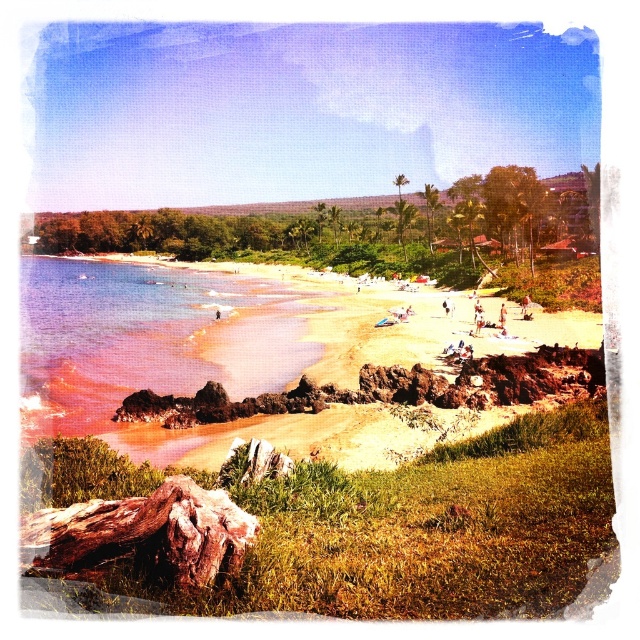
Question: Which point appears closest to the camera in this image?

Choices:
 (A) click(x=339, y=403)
 (B) click(x=77, y=340)

Answer: (A)

Question: Can you confirm if smooth sand beach at center is positioned to the right of pink sand at beach left?

Choices:
 (A) yes
 (B) no

Answer: (A)

Question: Which object appears closest to the camera in this image?

Choices:
 (A) smooth sand beach at center
 (B) pink sand at beach left

Answer: (A)

Question: Among these points, which one is farthest from the camera?

Choices:
 (A) (109, 349)
 (B) (33, 392)

Answer: (A)

Question: Is smooth sand beach at center bigger than pink sand at beach left?

Choices:
 (A) yes
 (B) no

Answer: (B)

Question: Does smooth sand beach at center have a greater width compared to pink sand at beach left?

Choices:
 (A) yes
 (B) no

Answer: (A)